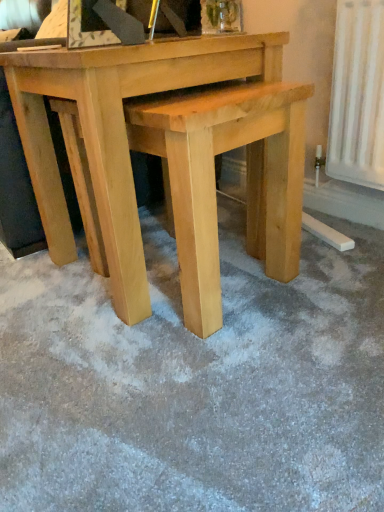
Identify the location of blank space situated above natural wood stool at center (from a real-world perspective). The height and width of the screenshot is (512, 384). (x=207, y=93).